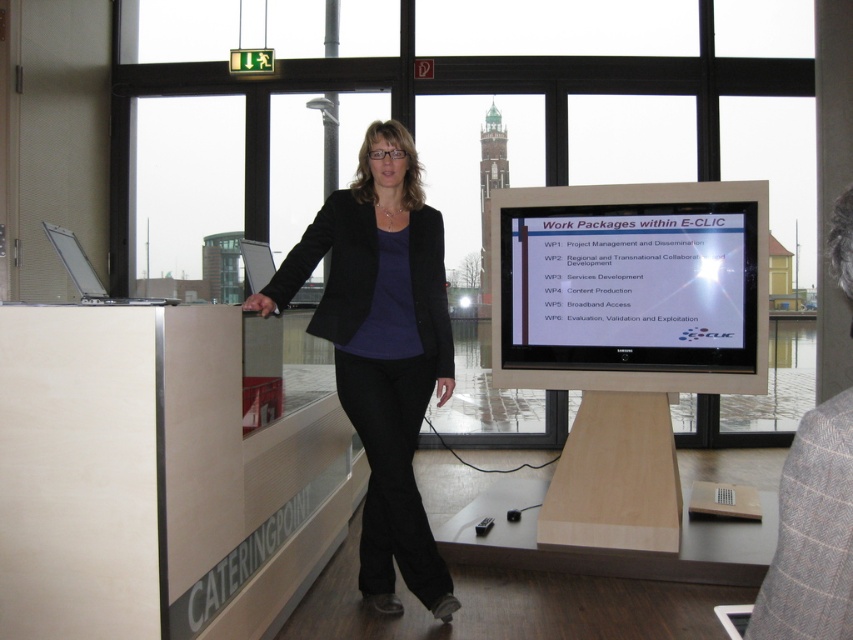
Does matte black monitor at center have a greater width compared to light brown wooden table at lower center?

No, matte black monitor at center is not wider than light brown wooden table at lower center.

Who is shorter, matte black monitor at center or light brown wooden table at lower center?

Standing shorter between the two is light brown wooden table at lower center.

Does point (584, 364) lie in front of point (527, 528)?

Yes, it is in front of point (527, 528).

The height and width of the screenshot is (640, 853). In order to click on matte black monitor at center in this screenshot , I will do `click(630, 285)`.

Is matte black blazer at center above silver metallic laptop at left?

No, matte black blazer at center is not above silver metallic laptop at left.

Is point (375, 237) less distant than point (82, 264)?

Yes.

Does point (372, 195) come farther from viewer compared to point (74, 280)?

That is False.

Where is `matte black blazer at center`? This screenshot has width=853, height=640. matte black blazer at center is located at coordinates (381, 349).

Is matte black blazer at center positioned at the back of light brown wooden table at lower center?

No, matte black blazer at center is closer to the viewer.

Between matte black blazer at center and light brown wooden table at lower center, which one is positioned lower?

light brown wooden table at lower center is lower down.

Where is `matte black blazer at center`? The width and height of the screenshot is (853, 640). matte black blazer at center is located at coordinates [x=381, y=349].